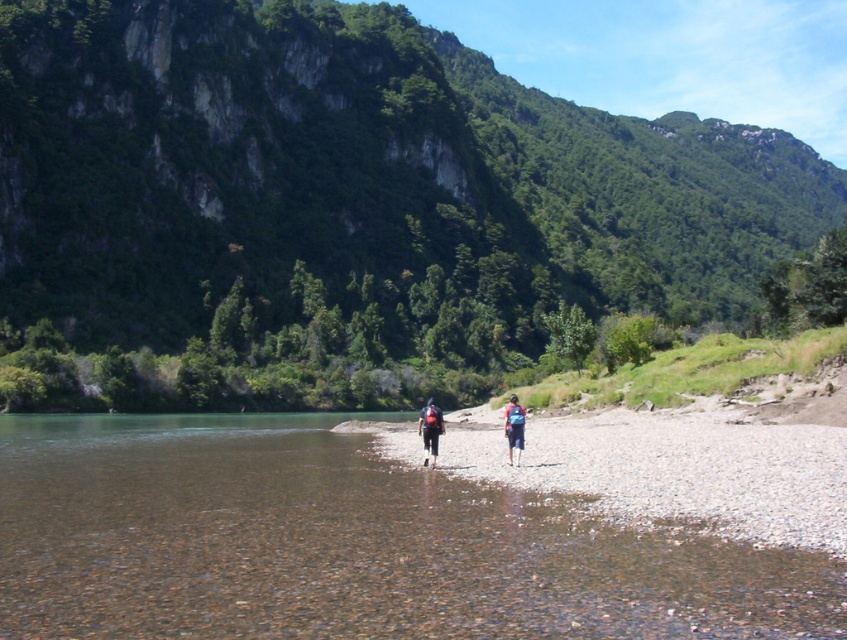
You are planning to carry both the matte black backpack at center and the blue fabric backpack at center on a hiking trip. Which backpack can hold more items based on their sizes?

The matte black backpack at center has a larger size compared to the blue fabric backpack at center, so it can hold more items.

You are a hiker who wants to cross the river at the riverbank. You see clear water at river center and a blue fabric backpack at center. Which direction should you head to find the clearer water for safe crossing?

The clear water at river center is to the left of the blue fabric backpack at center, so you should head towards the left side of the backpack to find the clearer water for a safer crossing.

You are planning to cross the river using the path between the clear water at river center and the blue fabric backpack at center. The path is narrow. If your boat is 2 meters wide, can you safely navigate through this path?

The clear water at river center is wider than the blue fabric backpack at center. Since the boat is 2 meters wide, and the path between them is determined by the narrower object, which is the blue fabric backpack at center, the boat may not fit safely. However, the description only states the width comparison between the two objects, not the actual path width. Without specific measurements, it is uncertain if the path is wide enough for the boat.